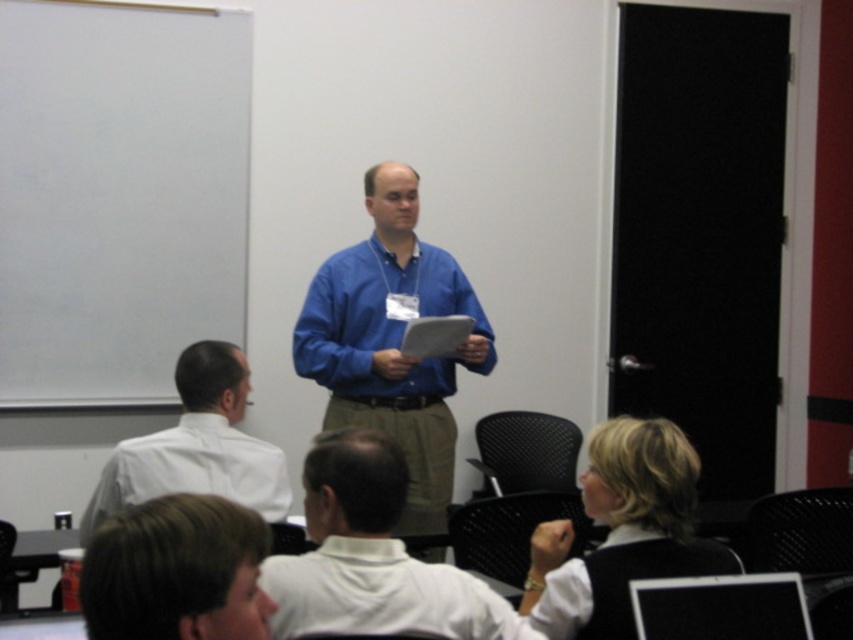
Question: Which point is closer to the camera taking this photo?

Choices:
 (A) (412, 216)
 (B) (212, 376)
 (C) (366, 467)
 (D) (537, 589)

Answer: (C)

Question: Is white fabric shirt at center to the right of brown hair at lower center from the viewer's perspective?

Choices:
 (A) no
 (B) yes

Answer: (B)

Question: Is white fabric shirt at center bigger than black fabric vest at lower right?

Choices:
 (A) no
 (B) yes

Answer: (A)

Question: Which of the following is the closest to the observer?

Choices:
 (A) (209, 449)
 (B) (251, 630)

Answer: (B)

Question: Can you confirm if blue fabric shirt at center is positioned to the right of white shirt at left?

Choices:
 (A) yes
 (B) no

Answer: (A)

Question: Which object is positioned closest to the blue fabric shirt at center?

Choices:
 (A) black fabric vest at lower right
 (B) brown hair at lower center
 (C) white fabric shirt at center
 (D) white shirt at left

Answer: (D)